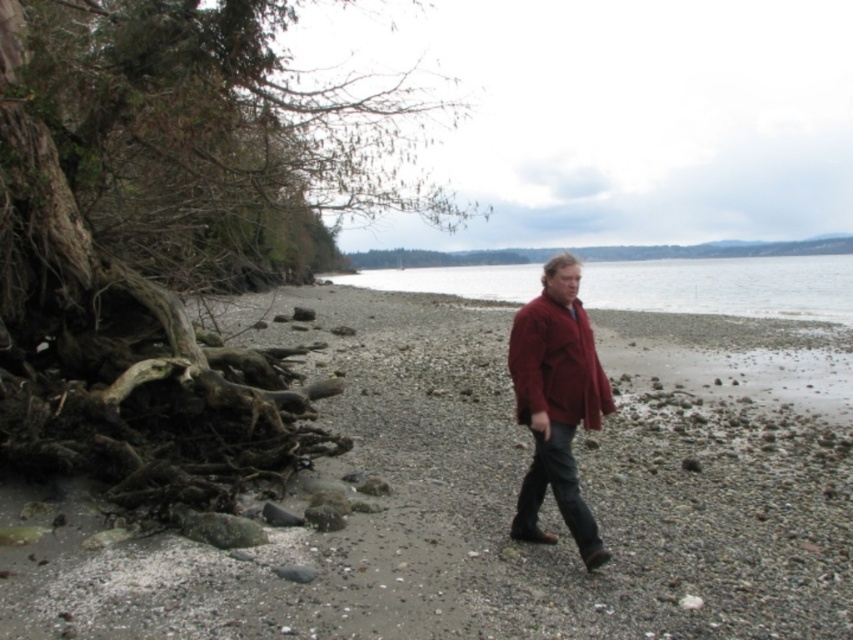
Question: Which point is farther to the camera?

Choices:
 (A) dark brown driftwood at left
 (B) smooth water at center
 (C) brown textured roots at left

Answer: (C)

Question: Is smooth pebbles at center below matte red coat at center?

Choices:
 (A) no
 (B) yes

Answer: (A)

Question: Where is brown textured roots at left located in relation to smooth water at center in the image?

Choices:
 (A) above
 (B) below

Answer: (A)

Question: Which point is farther to the camera?

Choices:
 (A) (544, 381)
 (B) (280, 449)
 (C) (547, 266)

Answer: (B)

Question: Considering the relative positions of brown textured roots at left and smooth water at center in the image provided, where is brown textured roots at left located with respect to smooth water at center?

Choices:
 (A) left
 (B) right

Answer: (A)

Question: Which point is farther to the camera?

Choices:
 (A) (480, 278)
 (B) (50, 76)
 (C) (138, 483)

Answer: (A)